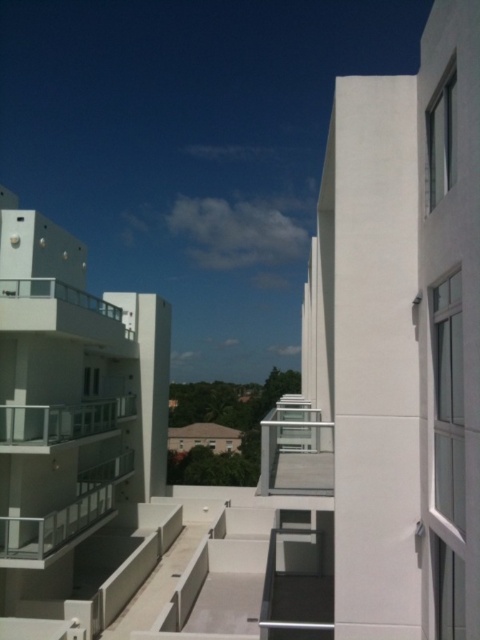
You are standing on the rooftop of the building and looking down. You see a clear glass balcony at center and a clear glass balcony at left. Which one is closer to you?

The clear glass balcony at center is closer to you because it is in front of the clear glass balcony at left.

You are standing on the balcony of the building and want to determine which of the two points, point (29, 419) or point (70, 296), is nearer to you. Based on the scene description, which point is closer?

Point (29, 419) is closer to the viewer than point (70, 296).

You are an architect evaluating two clear glass balconies in the scene. The clear glass balcony at center and the clear glass balcony at left. Which one has a smaller width?

The clear glass balcony at center has a smaller width than the clear glass balcony at left.